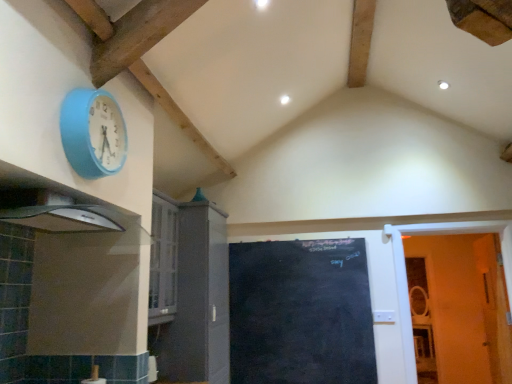
Question: Can you confirm if matte gray cabinet at center-left is thinner than white wooden door at right, which is the 1th door from right to left?

Choices:
 (A) yes
 (B) no

Answer: (B)

Question: Is white wooden door at right, which is the 1th door from right to left, at the back of matte gray cabinet at center-left?

Choices:
 (A) yes
 (B) no

Answer: (B)

Question: From a real-world perspective, is matte gray cabinet at center-left located beneath white wooden door at right, acting as the second door starting from the left?

Choices:
 (A) no
 (B) yes

Answer: (A)

Question: Does matte gray cabinet at center-left contain white wooden door at right, acting as the second door starting from the left?

Choices:
 (A) no
 (B) yes

Answer: (A)

Question: Is matte gray cabinet at center-left completely or partially outside of white wooden door at right, which is the 1th door from right to left?

Choices:
 (A) yes
 (B) no

Answer: (A)

Question: Does matte gray cabinet at center-left lie behind white wooden door at right, acting as the second door starting from the left?

Choices:
 (A) yes
 (B) no

Answer: (B)

Question: Are matte gray cabinet at center-left and black chalkboard at center, the 1th door from the left, located far from each other?

Choices:
 (A) yes
 (B) no

Answer: (B)

Question: Is matte gray cabinet at center-left positioned behind black chalkboard at center, the 1th door from the left?

Choices:
 (A) no
 (B) yes

Answer: (A)

Question: From the image's perspective, is matte gray cabinet at center-left on top of black chalkboard at center, the 1th door from the left?

Choices:
 (A) yes
 (B) no

Answer: (A)

Question: Is matte gray cabinet at center-left turned away from black chalkboard at center, positioned as the second door in right-to-left order?

Choices:
 (A) no
 (B) yes

Answer: (A)

Question: Is matte gray cabinet at center-left shorter than black chalkboard at center, the 1th door from the left?

Choices:
 (A) yes
 (B) no

Answer: (B)

Question: From a real-world perspective, is matte gray cabinet at center-left positioned under black chalkboard at center, the 1th door from the left, based on gravity?

Choices:
 (A) yes
 (B) no

Answer: (B)

Question: Is white wooden door at right, acting as the second door starting from the left, completely or partially outside of black chalkboard at center, the 1th door from the left?

Choices:
 (A) yes
 (B) no

Answer: (A)